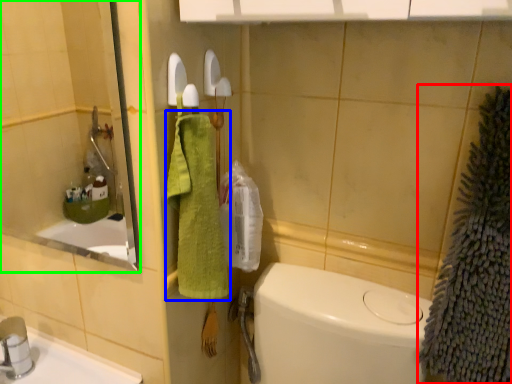
Question: Considering the real-world distances, which object is farthest from bath towel (highlighted by a red box)? bath towel (highlighted by a blue box) or mirror (highlighted by a green box)?

Choices:
 (A) bath towel
 (B) mirror

Answer: (B)